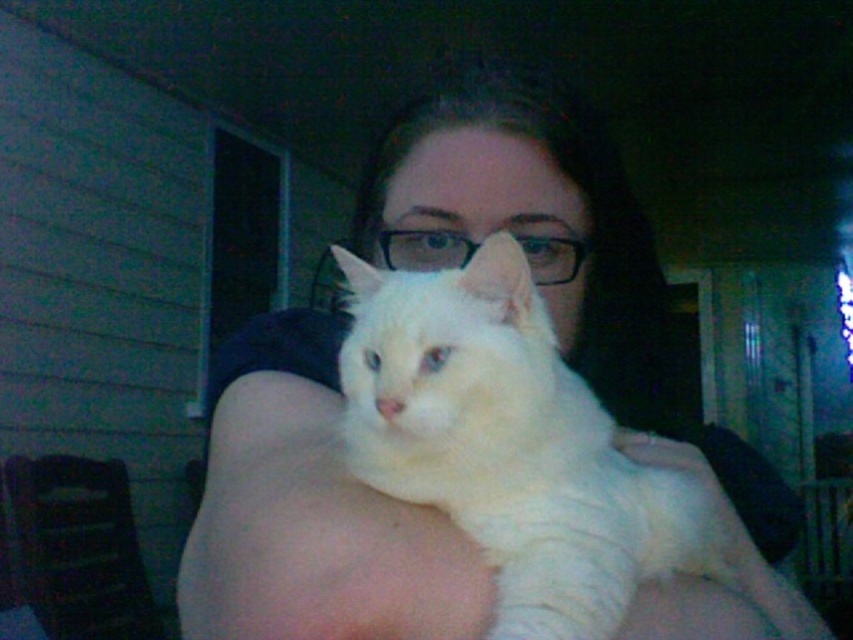
Does white fluffy cat at center appear on the right side of white soft hand at center?

No, white fluffy cat at center is not to the right of white soft hand at center.

Who is shorter, white fluffy cat at center or white soft hand at center?

white soft hand at center is shorter.

Locate an element on the screen. The image size is (853, 640). white fluffy cat at center is located at coordinates (509, 444).

How much distance is there between white fur cat at center and white soft hand at center?

They are 16.14 centimeters apart.

Measure the distance between white fur cat at center and camera.

They are 38.39 centimeters apart.

At what (x,y) coordinates should I click in order to perform the action: click on white fur cat at center. Please return your answer as a coordinate pair (x, y). This screenshot has width=853, height=640. Looking at the image, I should click on (577, 298).

Where is `white fur cat at center`? The height and width of the screenshot is (640, 853). white fur cat at center is located at coordinates (577, 298).

Does white fur cat at center lie in front of white fluffy cat at center?

Yes.

Between point (634, 314) and point (405, 388), which one is positioned behind?

Positioned behind is point (634, 314).

You are a GUI agent. You are given a task and a screenshot of the screen. Output one action in this format:
    pyautogui.click(x=<x>, y=<y>)
    Task: Click on the white fur cat at center
    
    Given the screenshot: What is the action you would take?
    pyautogui.click(x=577, y=298)